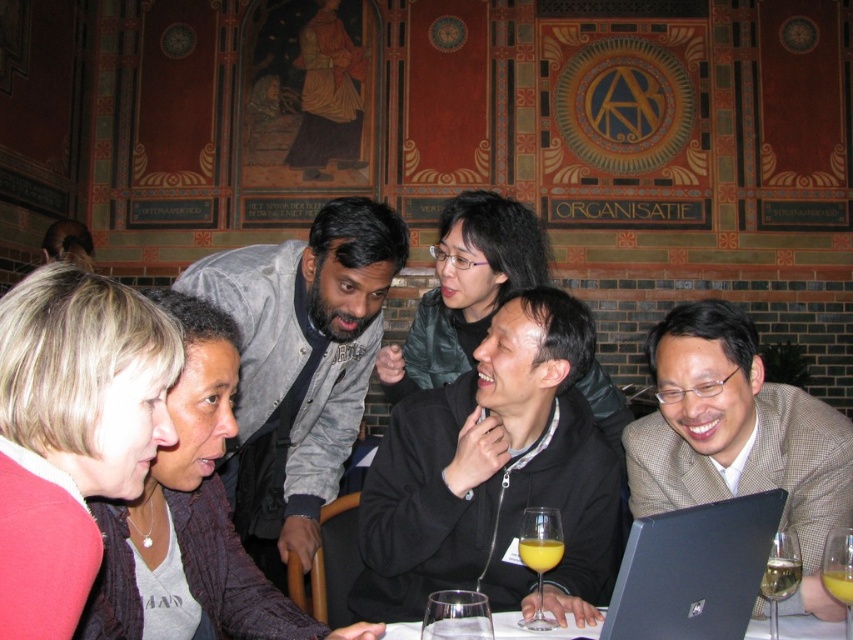
Question: Is the position of white glossy table at lower center less distant than that of translucent glass wine glass at lower right?

Choices:
 (A) no
 (B) yes

Answer: (A)

Question: Which point is farther to the camera?

Choices:
 (A) (672, 584)
 (B) (527, 548)
 (C) (567, 636)

Answer: (B)

Question: Is gray fleece jacket at upper left positioned in front of transparent glass at lower center?

Choices:
 (A) no
 (B) yes

Answer: (A)

Question: Does black plastic laptop at lower right appear on the right side of yellow translucent liquid at lower right?

Choices:
 (A) no
 (B) yes

Answer: (A)

Question: Which object appears farthest from the camera in this image?

Choices:
 (A) gray fleece jacket at upper left
 (B) yellow translucent liquid at lower right
 (C) translucent yellow glass at lower center

Answer: (A)

Question: Which of the following is the closest to the observer?

Choices:
 (A) (560, 540)
 (B) (836, 444)
 (C) (469, 486)

Answer: (A)